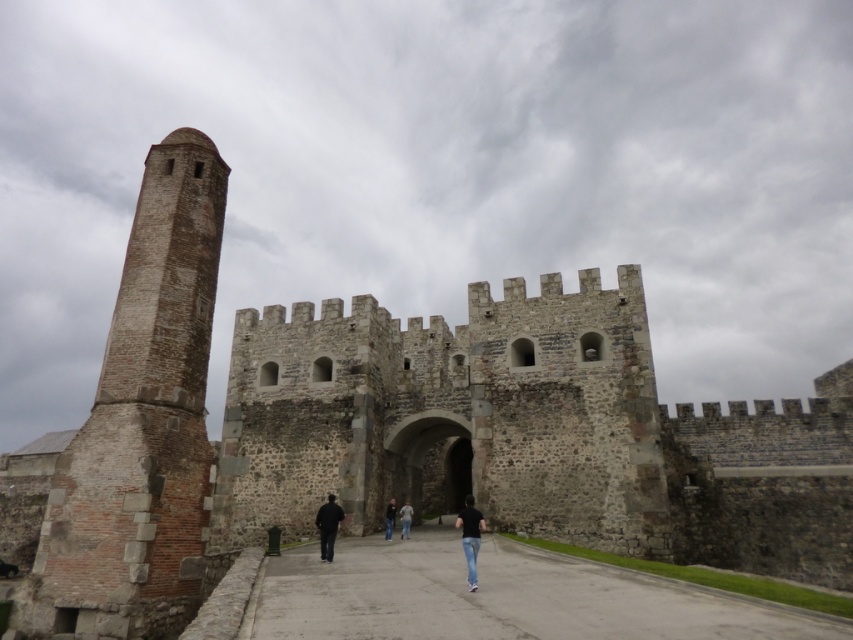
Identify the location of gray concrete path at center. (500, 596).

Between gray concrete path at center and dark gray fabric jacket at center, which one is positioned lower?

Positioned lower is dark gray fabric jacket at center.

Which is in front, point (341, 634) or point (320, 524)?

Point (341, 634) is more forward.

The image size is (853, 640). I want to click on gray concrete path at center, so click(500, 596).

Measure the distance between black matte shirt at center and dark blue jeans at center.

11.99 meters

Is black matte shirt at center taller than dark blue jeans at center?

Yes, black matte shirt at center is taller than dark blue jeans at center.

Describe the element at coordinates (469, 536) in the screenshot. Image resolution: width=853 pixels, height=640 pixels. I see `black matte shirt at center` at that location.

At what (x,y) coordinates should I click in order to perform the action: click on black matte shirt at center. Please return your answer as a coordinate pair (x, y). This screenshot has height=640, width=853. Looking at the image, I should click on (469, 536).

Is dark gray fabric jacket at center shorter than dark blue jeans at center?

In fact, dark gray fabric jacket at center may be taller than dark blue jeans at center.

Based on the photo, does dark gray fabric jacket at center appear over dark blue jeans at center?

Indeed, dark gray fabric jacket at center is positioned over dark blue jeans at center.

Which is in front, point (341, 509) or point (386, 536)?

Positioned in front is point (341, 509).

I want to click on dark gray fabric jacket at center, so pyautogui.click(x=328, y=525).